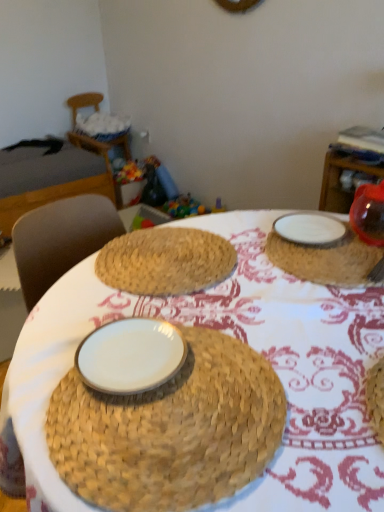
Identify the location of unoccupied area in front of white ceramic plate at upper right. click(x=316, y=325).